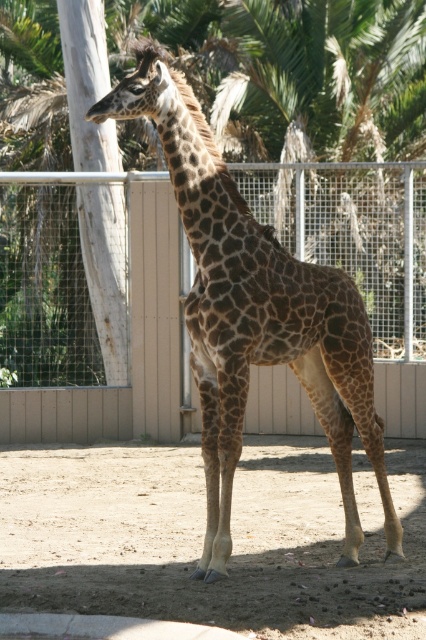
Question: Can you confirm if brown sandy dirt at center is wider than brown spotted giraffe at center?

Choices:
 (A) yes
 (B) no

Answer: (B)

Question: Which object is positioned farthest from the brown sandy dirt at center?

Choices:
 (A) brown spotted giraffe at center
 (B) metal mesh fence at center

Answer: (B)

Question: Which point is farther to the camera?

Choices:
 (A) (74, 214)
 (B) (57, 586)
 (C) (203, 292)

Answer: (A)

Question: Is brown sandy dirt at center further to the viewer compared to brown spotted giraffe at center?

Choices:
 (A) no
 (B) yes

Answer: (B)

Question: Which point is farther to the camera?

Choices:
 (A) brown spotted giraffe at center
 (B) brown sandy dirt at center

Answer: (B)

Question: Can you confirm if brown sandy dirt at center is positioned below metal mesh fence at center?

Choices:
 (A) no
 (B) yes

Answer: (B)